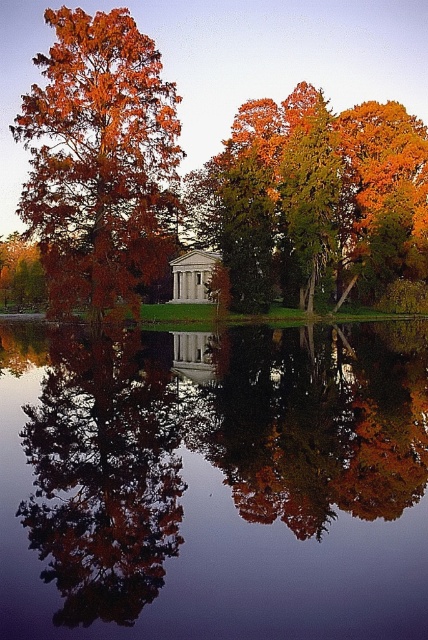
Is orange foliage tree at upper left behind golden-green foliage at center?

No, orange foliage tree at upper left is in front of golden-green foliage at center.

Does orange foliage tree at upper left have a lesser height compared to golden-green foliage at center?

Incorrect, orange foliage tree at upper left's height does not fall short of golden-green foliage at center's.

Describe the element at coordinates (228, 65) in the screenshot. I see `orange foliage tree at upper left` at that location.

Image resolution: width=428 pixels, height=640 pixels. In order to click on orange foliage tree at upper left in this screenshot , I will do `click(228, 65)`.

From the picture: Does smooth reflective water at center have a greater width compared to orange foliage tree at upper left?

No.

Does smooth reflective water at center appear on the right side of orange foliage tree at upper left?

Yes, smooth reflective water at center is to the right of orange foliage tree at upper left.

Does point (125, 472) come farther from viewer compared to point (64, 49)?

No, it is not.

In order to click on smooth reflective water at center in this screenshot , I will do `click(214, 483)`.

Does autumn leaves at center have a lesser width compared to golden-green foliage at center?

Indeed, autumn leaves at center has a lesser width compared to golden-green foliage at center.

Is autumn leaves at center closer to camera compared to golden-green foliage at center?

That is True.

Is point (335, 448) closer to viewer compared to point (339, 180)?

Yes.

Locate an element on the screen. autumn leaves at center is located at coordinates (321, 420).